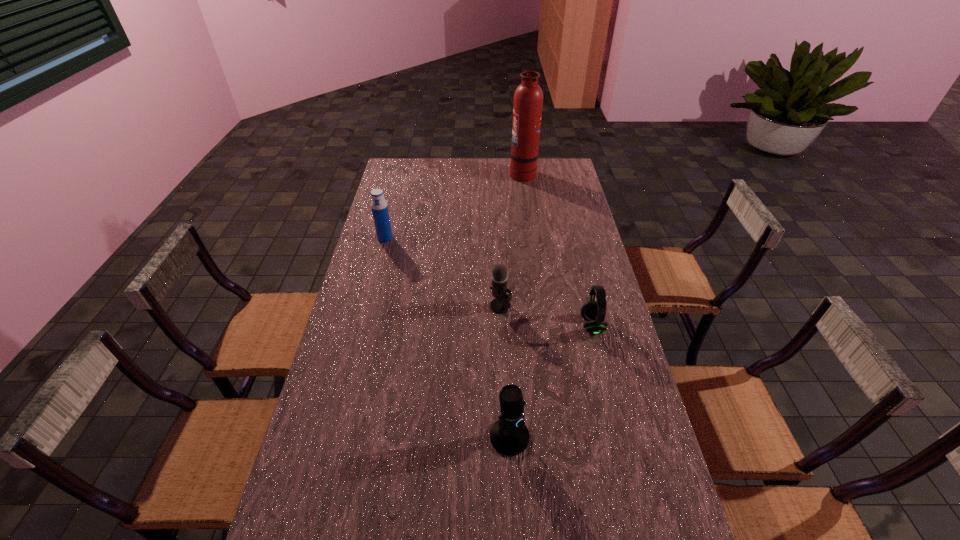
Image resolution: width=960 pixels, height=540 pixels. What are the coordinates of `the tallest object` in the screenshot? It's located at (528, 99).

What are the coordinates of `fire extinguisher` in the screenshot? It's located at (528, 99).

I want to click on the second farthest object, so click(x=379, y=206).

You are a GUI agent. You are given a task and a screenshot of the screen. Output one action in this format:
    pyautogui.click(x=<x>, y=<y>)
    Task: Click on the water bottle
    
    Given the screenshot: What is the action you would take?
    pyautogui.click(x=379, y=206)

Where is `the nearest object`? This screenshot has height=540, width=960. the nearest object is located at coordinates (509, 435).

Where is `the farther microphone`? Image resolution: width=960 pixels, height=540 pixels. the farther microphone is located at coordinates (501, 304).

Identify the location of the shortest object. Image resolution: width=960 pixels, height=540 pixels. (593, 312).

Where is `headset`? This screenshot has height=540, width=960. headset is located at coordinates (593, 312).

Locate an element on the screen. The width and height of the screenshot is (960, 540). vacant space located on the label side of the fourth object from left to right is located at coordinates (476, 173).

Locate an element on the screen. This screenshot has width=960, height=540. vacant area located on the label side of the fourth object from left to right is located at coordinates (451, 173).